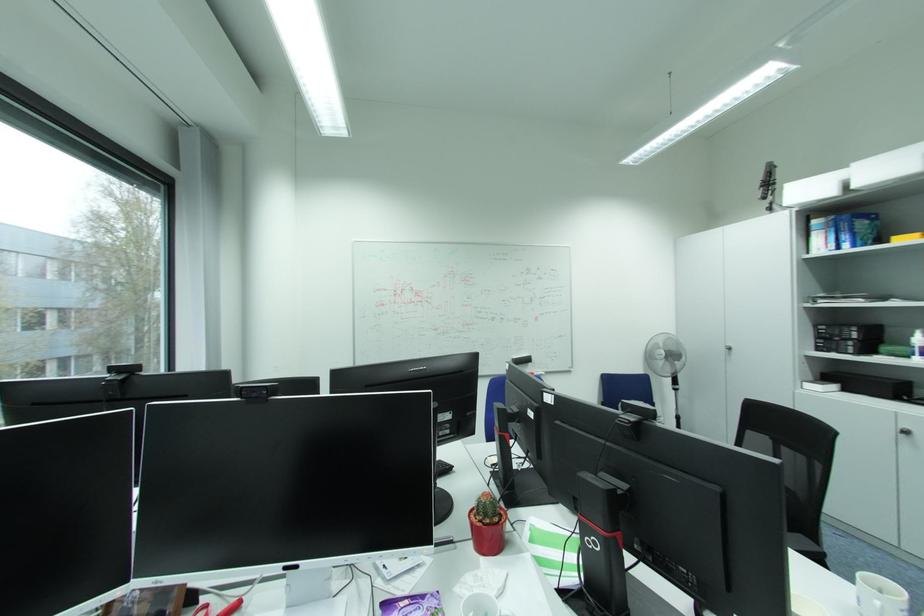
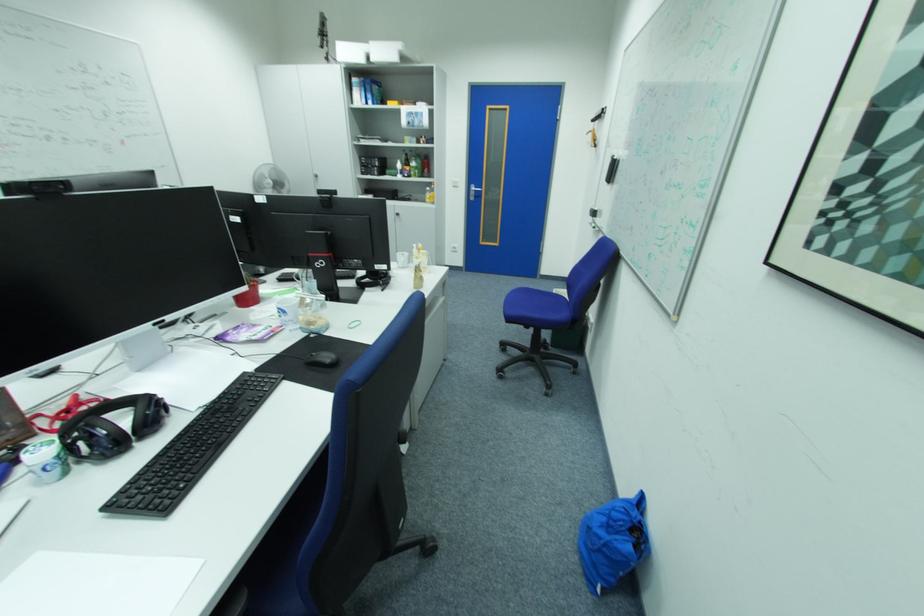
The images are taken continuously from a first-person perspective. In which direction is your viewpoint rotating?

The rotation direction of the camera is right-down.